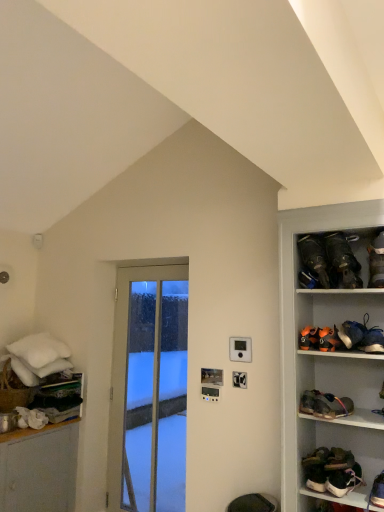
Question: Could you tell me if clear glass door at center is turned towards dark brown leather shoes at upper right, the 8th footwear when ordered from bottom to top?

Choices:
 (A) yes
 (B) no

Answer: (B)

Question: Is clear glass door at center taller than dark brown leather shoes at upper right, the 8th footwear when ordered from bottom to top?

Choices:
 (A) yes
 (B) no

Answer: (A)

Question: Can you confirm if clear glass door at center is wider than dark brown leather shoes at upper right, the 8th footwear when ordered from bottom to top?

Choices:
 (A) yes
 (B) no

Answer: (B)

Question: Does clear glass door at center have a smaller size compared to dark brown leather shoes at upper right, the 8th footwear when ordered from bottom to top?

Choices:
 (A) yes
 (B) no

Answer: (B)

Question: Considering the relative sizes of clear glass door at center and dark brown leather shoes at upper right, the 8th footwear when ordered from bottom to top, in the image provided, is clear glass door at center bigger than dark brown leather shoes at upper right, the 8th footwear when ordered from bottom to top,?

Choices:
 (A) yes
 (B) no

Answer: (A)

Question: Are clear glass door at center and dark brown leather shoes at upper right, the 8th footwear when ordered from bottom to top, beside each other?

Choices:
 (A) yes
 (B) no

Answer: (B)

Question: Is leather brown shoe at right, the 5th footwear from the bottom, thinner than brown suede boot at right, the second footwear positioned from the top?

Choices:
 (A) yes
 (B) no

Answer: (B)

Question: Is leather brown shoe at right, placed as the sixth footwear when sorted from top to bottom, completely or partially outside of brown suede boot at right, the second footwear positioned from the top?

Choices:
 (A) no
 (B) yes

Answer: (B)

Question: Is leather brown shoe at right, placed as the sixth footwear when sorted from top to bottom, at the right side of brown suede boot at right, the 9th footwear positioned from the bottom?

Choices:
 (A) yes
 (B) no

Answer: (B)

Question: Considering the relative sizes of leather brown shoe at right, placed as the sixth footwear when sorted from top to bottom, and brown suede boot at right, the 9th footwear positioned from the bottom, in the image provided, is leather brown shoe at right, placed as the sixth footwear when sorted from top to bottom, smaller than brown suede boot at right, the 9th footwear positioned from the bottom,?

Choices:
 (A) yes
 (B) no

Answer: (A)

Question: From the image's perspective, is leather brown shoe at right, placed as the sixth footwear when sorted from top to bottom, over brown suede boot at right, the 9th footwear positioned from the bottom?

Choices:
 (A) yes
 (B) no

Answer: (B)

Question: From a real-world perspective, is leather brown shoe at right, placed as the sixth footwear when sorted from top to bottom, positioned over brown suede boot at right, the second footwear positioned from the top, based on gravity?

Choices:
 (A) yes
 (B) no

Answer: (B)

Question: Is white leather sneakers at lower right, acting as the tenth footwear starting from the top, oriented away from leather brown shoe at right, the 5th footwear from the bottom?

Choices:
 (A) yes
 (B) no

Answer: (B)